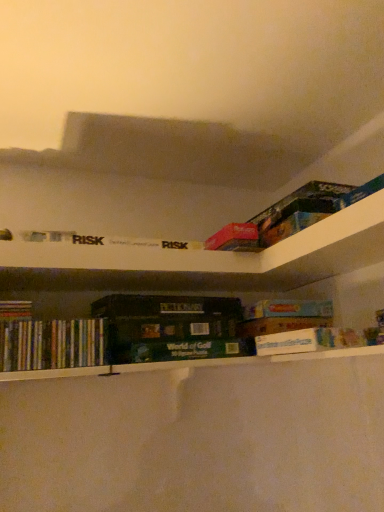
The width and height of the screenshot is (384, 512). What do you see at coordinates (309, 341) in the screenshot?
I see `white cardboard box at center, which appears as the first book when viewed from the right` at bounding box center [309, 341].

This screenshot has width=384, height=512. What do you see at coordinates (52, 344) in the screenshot?
I see `multicolored paperbacks at lower left, which is counted as the first book, starting from the left` at bounding box center [52, 344].

This screenshot has width=384, height=512. What are the coordinates of `hardcover dictionary at center` in the screenshot? It's located at (164, 306).

Is multicolored paperbacks at lower left, which is counted as the first book, starting from the left, oriented away from hardcover dictionary at center?

No, multicolored paperbacks at lower left, which is counted as the first book, starting from the left, is not facing away from hardcover dictionary at center.

Considering the relative positions of multicolored paperbacks at lower left, which is counted as the first book, starting from the left, and hardcover dictionary at center in the image provided, is multicolored paperbacks at lower left, which is counted as the first book, starting from the left, behind hardcover dictionary at center?

No, multicolored paperbacks at lower left, which is counted as the first book, starting from the left, is closer to the camera.

From the picture: Is multicolored paperbacks at lower left, the second book when ordered from right to left, completely or partially outside of hardcover dictionary at center?

Yes, multicolored paperbacks at lower left, the second book when ordered from right to left, is outside of hardcover dictionary at center.

From the image's perspective, would you say multicolored paperbacks at lower left, the second book when ordered from right to left, is shown under hardcover dictionary at center?

Yes, from the image's perspective, multicolored paperbacks at lower left, the second book when ordered from right to left, is below hardcover dictionary at center.

From a real-world perspective, is hardcover dictionary at center positioned over multicolored paperbacks at lower left, which is counted as the first book, starting from the left, based on gravity?

Yes, from a real-world perspective, hardcover dictionary at center is over multicolored paperbacks at lower left, which is counted as the first book, starting from the left

Is hardcover dictionary at center far away from multicolored paperbacks at lower left, the second book when ordered from right to left?

They are positioned close to each other.

Considering the sizes of objects hardcover dictionary at center and multicolored paperbacks at lower left, which is counted as the first book, starting from the left, in the image provided, who is bigger, hardcover dictionary at center or multicolored paperbacks at lower left, which is counted as the first book, starting from the left,?

hardcover dictionary at center.

Which is farther from the camera, [128,310] or [55,366]?

The point [128,310] is farther.

Is hardcover dictionary at center positioned with its back to white cardboard box at center, the second book when ordered from left to right?

No.

Based on the photo, between hardcover dictionary at center and white cardboard box at center, which appears as the first book when viewed from the right, which one has more height?

Standing taller between the two is white cardboard box at center, which appears as the first book when viewed from the right.

In the scene shown: Is hardcover dictionary at center in front of white cardboard box at center, which appears as the first book when viewed from the right?

No, it is behind white cardboard box at center, which appears as the first book when viewed from the right.

Can you tell me how much hardcover dictionary at center and white cardboard box at center, the second book when ordered from left to right, differ in facing direction?

There is a 93.7-degree angle between the facing directions of hardcover dictionary at center and white cardboard box at center, the second book when ordered from left to right.

Is white cardboard box at center, which appears as the first book when viewed from the right, shorter than hardcover dictionary at center?

In fact, white cardboard box at center, which appears as the first book when viewed from the right, may be taller than hardcover dictionary at center.

Considering the relative sizes of white cardboard box at center, the second book when ordered from left to right, and hardcover dictionary at center in the image provided, is white cardboard box at center, the second book when ordered from left to right, thinner than hardcover dictionary at center?

No, white cardboard box at center, the second book when ordered from left to right, is not thinner than hardcover dictionary at center.

Locate an element on the screen. The width and height of the screenshot is (384, 512). the 2nd book positioned below the hardcover dictionary at center (from a real-world perspective) is located at coordinates (309, 341).

Is white cardboard box at center, which appears as the first book when viewed from the right, behind multicolored paperbacks at lower left, which is counted as the first book, starting from the left?

Yes, it is.

Does point (338, 343) lie behind point (14, 355)?

Yes, it is behind point (14, 355).

From the image's perspective, is white cardboard box at center, the second book when ordered from left to right, below multicolored paperbacks at lower left, which is counted as the first book, starting from the left?

No.

Is white cardboard box at center, which appears as the first book when viewed from the right, bigger or smaller than multicolored paperbacks at lower left, the second book when ordered from right to left?

white cardboard box at center, which appears as the first book when viewed from the right, is bigger than multicolored paperbacks at lower left, the second book when ordered from right to left.

Is multicolored paperbacks at lower left, which is counted as the first book, starting from the left, to the left of white cardboard box at center, the second book when ordered from left to right, from the viewer's perspective?

Yes.

Is multicolored paperbacks at lower left, the second book when ordered from right to left, bigger than white cardboard box at center, the second book when ordered from left to right?

Actually, multicolored paperbacks at lower left, the second book when ordered from right to left, might be smaller than white cardboard box at center, the second book when ordered from left to right.

Considering the relative sizes of multicolored paperbacks at lower left, which is counted as the first book, starting from the left, and white cardboard box at center, the second book when ordered from left to right, in the image provided, is multicolored paperbacks at lower left, which is counted as the first book, starting from the left, thinner than white cardboard box at center, the second book when ordered from left to right,?

Yes, multicolored paperbacks at lower left, which is counted as the first book, starting from the left, is thinner than white cardboard box at center, the second book when ordered from left to right.

How far apart are multicolored paperbacks at lower left, the second book when ordered from right to left, and white cardboard box at center, the second book when ordered from left to right?

multicolored paperbacks at lower left, the second book when ordered from right to left, is 54.56 centimeters from white cardboard box at center, the second book when ordered from left to right.

Identify the location of paperback book behind the multicolored paperbacks at lower left, which is counted as the first book, starting from the left. (164, 306).

Find the location of a particular element. The height and width of the screenshot is (512, 384). paperback book above the multicolored paperbacks at lower left, which is counted as the first book, starting from the left (from a real-world perspective) is located at coordinates pyautogui.click(x=164, y=306).

Considering their positions, is multicolored paperbacks at lower left, the second book when ordered from right to left, positioned further to hardcover dictionary at center than white cardboard box at center, which appears as the first book when viewed from the right?

The object further to hardcover dictionary at center is white cardboard box at center, which appears as the first book when viewed from the right.

From the image, which object appears to be nearer to multicolored paperbacks at lower left, the second book when ordered from right to left, white cardboard box at center, which appears as the first book when viewed from the right, or hardcover dictionary at center?

hardcover dictionary at center is closer to multicolored paperbacks at lower left, the second book when ordered from right to left.

Which object lies nearer to the anchor point white cardboard box at center, which appears as the first book when viewed from the right, hardcover dictionary at center or multicolored paperbacks at lower left, which is counted as the first book, starting from the left?

hardcover dictionary at center is closer to white cardboard box at center, which appears as the first book when viewed from the right.

Based on their spatial positions, is multicolored paperbacks at lower left, which is counted as the first book, starting from the left, or hardcover dictionary at center further from white cardboard box at center, which appears as the first book when viewed from the right?

multicolored paperbacks at lower left, which is counted as the first book, starting from the left.

From the image, which object appears to be nearer to multicolored paperbacks at lower left, which is counted as the first book, starting from the left, hardcover dictionary at center or white cardboard box at center, the second book when ordered from left to right?

hardcover dictionary at center is positioned closer to the anchor multicolored paperbacks at lower left, which is counted as the first book, starting from the left.

Which object lies nearer to the anchor point hardcover dictionary at center, white cardboard box at center, which appears as the first book when viewed from the right, or multicolored paperbacks at lower left, the second book when ordered from right to left?

multicolored paperbacks at lower left, the second book when ordered from right to left, is positioned closer to the anchor hardcover dictionary at center.

Locate an element on the screen. This screenshot has width=384, height=512. paperback book between multicolored paperbacks at lower left, the second book when ordered from right to left, and white cardboard box at center, which appears as the first book when viewed from the right, from left to right is located at coordinates (164, 306).